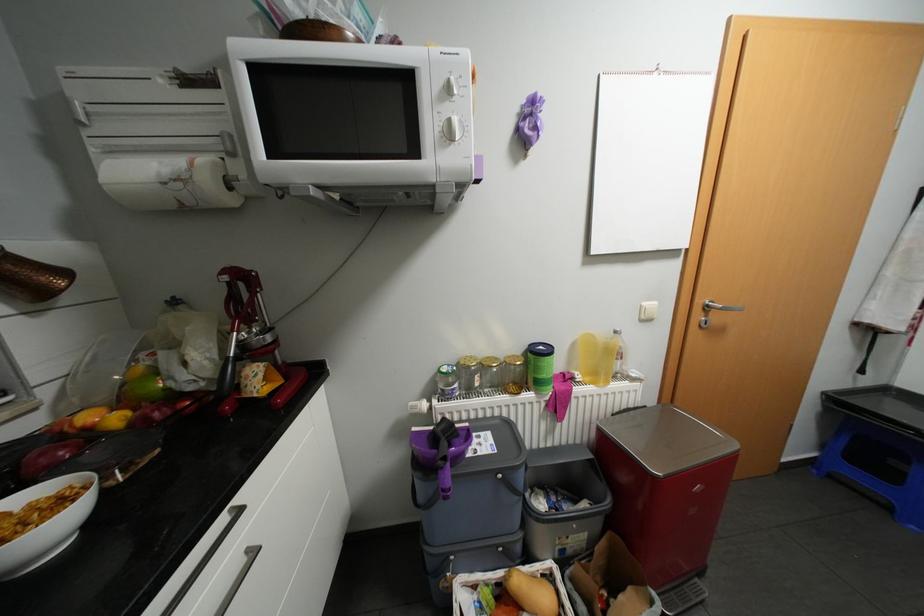
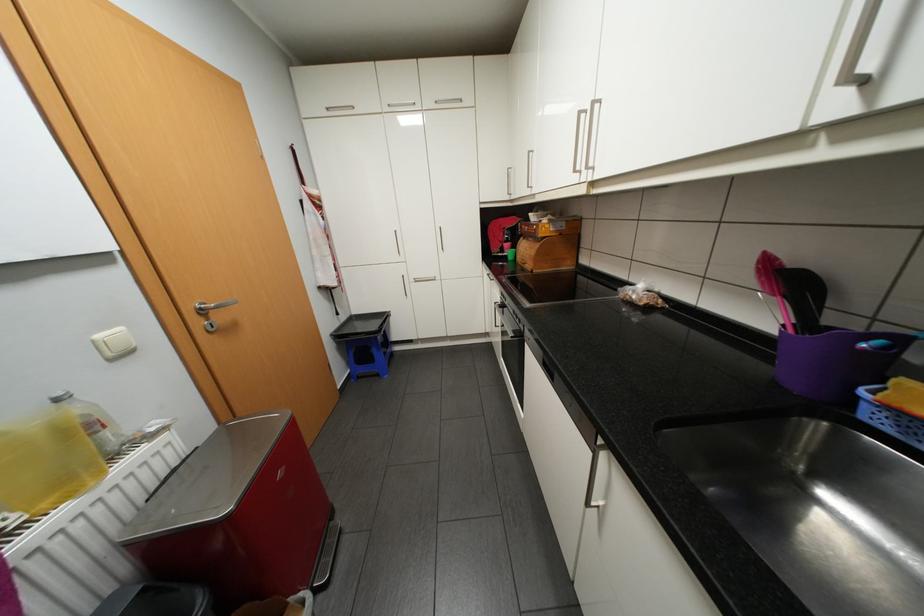
Locate, in the second image, the point that corresponds to point (652, 302) in the first image.

(106, 334)